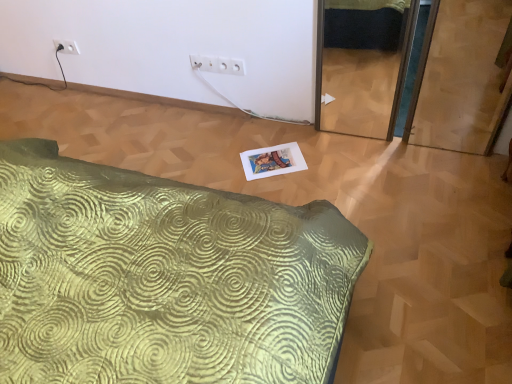
Question: From the image's perspective, relative to white plastic electric outlet at upper left, the second electric outlet viewed from the front, is white plastic outlet at upper center, the 2th electric outlet from the top, above or below?

Choices:
 (A) below
 (B) above

Answer: (A)

Question: Is white plastic outlet at upper center, the 2th electric outlet from the top, wider or thinner than white plastic electric outlet at upper left, placed as the first electric outlet when sorted from back to front?

Choices:
 (A) wide
 (B) thin

Answer: (A)

Question: Estimate the real-world distances between objects in this image. Which object is closer to the white plastic electric outlet at upper left, the second electric outlet positioned from the right?

Choices:
 (A) green textured bed at lower left
 (B) white plastic outlet at upper center, the second electric outlet in the back-to-front sequence

Answer: (B)

Question: Estimate the real-world distances between objects in this image. Which object is closer to the white plastic electric outlet at upper left, the second electric outlet positioned from the right?

Choices:
 (A) white plastic outlet at upper center, the second electric outlet in the back-to-front sequence
 (B) green textured bed at lower left

Answer: (A)